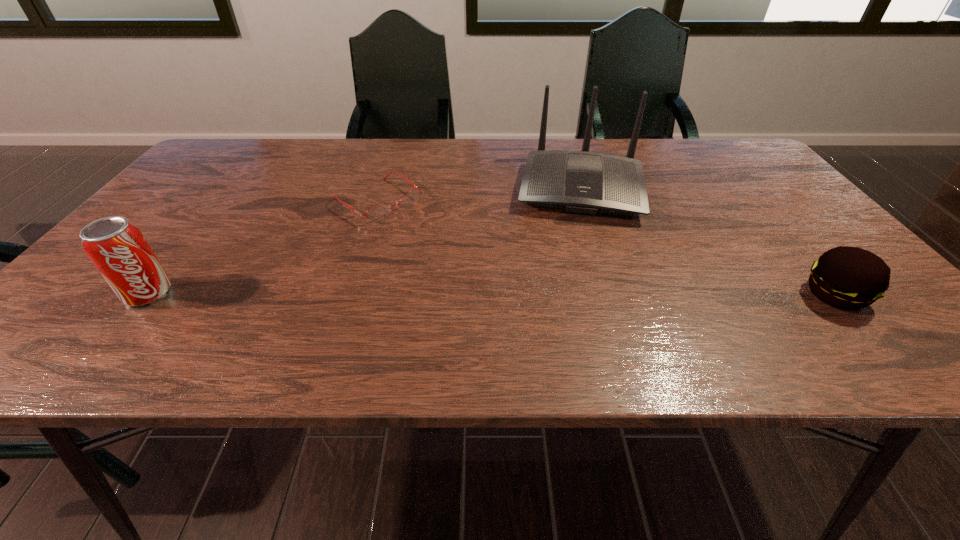
The height and width of the screenshot is (540, 960). I want to click on the third shortest object, so click(117, 248).

Image resolution: width=960 pixels, height=540 pixels. In order to click on soda can in this screenshot , I will do `click(117, 248)`.

This screenshot has height=540, width=960. I want to click on patty, so click(x=849, y=278).

Find the location of a particular element. Image resolution: width=960 pixels, height=540 pixels. the rightmost object is located at coordinates (849, 278).

You are a GUI agent. You are given a task and a screenshot of the screen. Output one action in this format:
    pyautogui.click(x=<x>, y=<y>)
    Task: Click on the shortest object
    This screenshot has width=960, height=540.
    Given the screenshot: What is the action you would take?
    pyautogui.click(x=379, y=212)

The width and height of the screenshot is (960, 540). What are the coordinates of `spectacles` in the screenshot? It's located at (379, 212).

In order to click on the tallest object in this screenshot , I will do `click(584, 182)`.

Locate an element on the screen. Image resolution: width=960 pixels, height=540 pixels. the third object from left to right is located at coordinates (584, 182).

Find the location of a particular element. This screenshot has width=960, height=540. vacant space located on the back of the second tallest object is located at coordinates (234, 186).

In order to click on vacant space located 0.250m on the back of the rightmost object in this screenshot , I will do `click(761, 209)`.